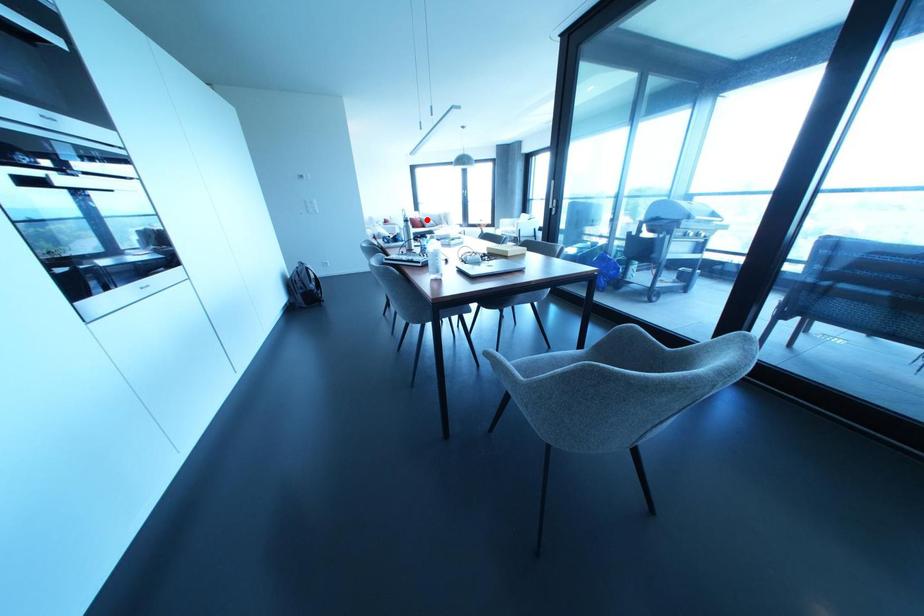
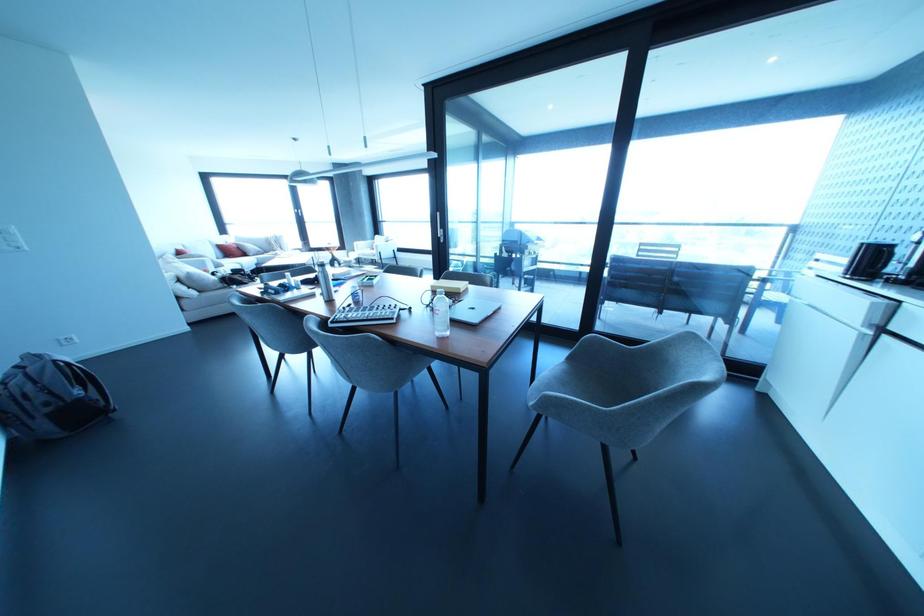
The point at the highlighted location is marked in the first image. Where is the corresponding point in the second image?

(249, 246)